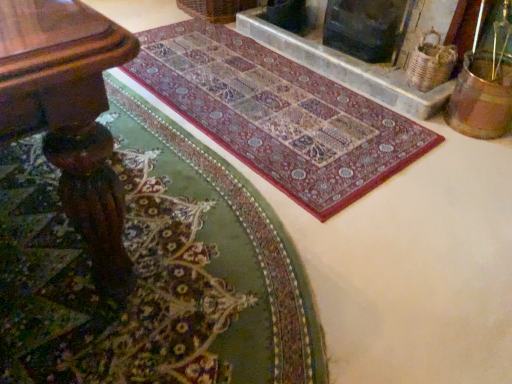
Question: Looking at the image, does wooden table at lower left seem bigger or smaller compared to multicolored woven rug at center, which is counted as the second mat, starting from the back?

Choices:
 (A) small
 (B) big

Answer: (B)

Question: Is wooden table at lower left in front of or behind multicolored woven rug at center, which is counted as the second mat, starting from the back, in the image?

Choices:
 (A) front
 (B) behind

Answer: (A)

Question: Estimate the real-world distances between objects in this image. Which object is farther from the dark gray stone fireplace at upper center, acting as the first fireplace starting from the right?

Choices:
 (A) multicolored woven rug at center, marked as the first mat in a front-to-back arrangement
 (B) carpet with intricate patterns at center, the 2th mat in the front-to-back sequence
 (C) marble fireplace at upper center, which is the second fireplace in right-to-left order
 (D) wooden table at lower left

Answer: (D)

Question: Estimate the real-world distances between objects in this image. Which object is farther from the multicolored woven rug at center, marked as the first mat in a front-to-back arrangement?

Choices:
 (A) marble fireplace at upper center, which is the second fireplace in right-to-left order
 (B) wooden table at lower left
 (C) dark gray stone fireplace at upper center, acting as the first fireplace starting from the right
 (D) carpet with intricate patterns at center, the 2th mat in the front-to-back sequence

Answer: (C)